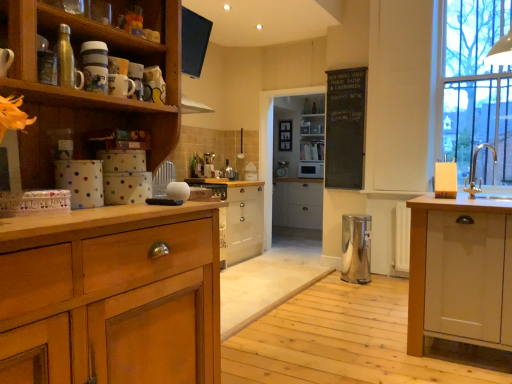
Question: Would you say metallic silver water bottle at upper left, marked as the fourth appliance in a right-to-left arrangement, contains silver metallic sink at right?

Choices:
 (A) yes
 (B) no

Answer: (B)

Question: Can you confirm if metallic silver water bottle at upper left, which is counted as the fourth appliance, starting from the back, is positioned to the left of silver metallic sink at right?

Choices:
 (A) no
 (B) yes

Answer: (B)

Question: Is metallic silver water bottle at upper left, acting as the 1th appliance starting from the top, smaller than silver metallic sink at right?

Choices:
 (A) yes
 (B) no

Answer: (A)

Question: From the image's perspective, would you say metallic silver water bottle at upper left, acting as the 1th appliance starting from the top, is shown under silver metallic sink at right?

Choices:
 (A) no
 (B) yes

Answer: (A)

Question: Is metallic silver water bottle at upper left, the 1th appliance positioned from the front, not close to silver metallic sink at right?

Choices:
 (A) no
 (B) yes

Answer: (B)

Question: Is white glossy microwave at center, the 1th appliance when ordered from back to front, in front of or behind polished stainless steel trash can at center, the 4th appliance in the left-to-right sequence, in the image?

Choices:
 (A) behind
 (B) front

Answer: (A)

Question: In terms of size, does white glossy microwave at center, arranged as the third appliance when ordered from the bottom, appear bigger or smaller than polished stainless steel trash can at center, which is counted as the fourth appliance, starting from the top?

Choices:
 (A) big
 (B) small

Answer: (B)

Question: In the image, is white glossy microwave at center, the 1th appliance when ordered from back to front, on the left side or the right side of polished stainless steel trash can at center, which ranks as the 1th appliance in right-to-left order?

Choices:
 (A) left
 (B) right

Answer: (A)

Question: Choose the correct answer: Is white glossy microwave at center, the 1th appliance when ordered from back to front, inside polished stainless steel trash can at center, which is counted as the second appliance, starting from the front, or outside it?

Choices:
 (A) outside
 (B) inside

Answer: (A)

Question: From a real-world perspective, relative to white wood cabinet at center, arranged as the first cabinetry when viewed from the right, is metallic silver coffee machine at center vertically above or below?

Choices:
 (A) above
 (B) below

Answer: (A)

Question: Choose the correct answer: Is metallic silver coffee machine at center inside white wood cabinet at center, the second cabinetry viewed from the left, or outside it?

Choices:
 (A) outside
 (B) inside

Answer: (A)

Question: Considering their positions, is metallic silver coffee machine at center located in front of or behind white wood cabinet at center, the second cabinetry viewed from the left?

Choices:
 (A) behind
 (B) front

Answer: (B)

Question: Visually, is metallic silver coffee machine at center positioned to the left or to the right of white wood cabinet at center, the second cabinetry viewed from the left?

Choices:
 (A) left
 (B) right

Answer: (A)

Question: In terms of height, does wooden cabinet at center, the second cabinetry positioned from the right, look taller or shorter compared to silver metallic sink at right?

Choices:
 (A) short
 (B) tall

Answer: (B)

Question: Considering their positions, is wooden cabinet at center, the 1th cabinetry from the left, located in front of or behind silver metallic sink at right?

Choices:
 (A) front
 (B) behind

Answer: (B)